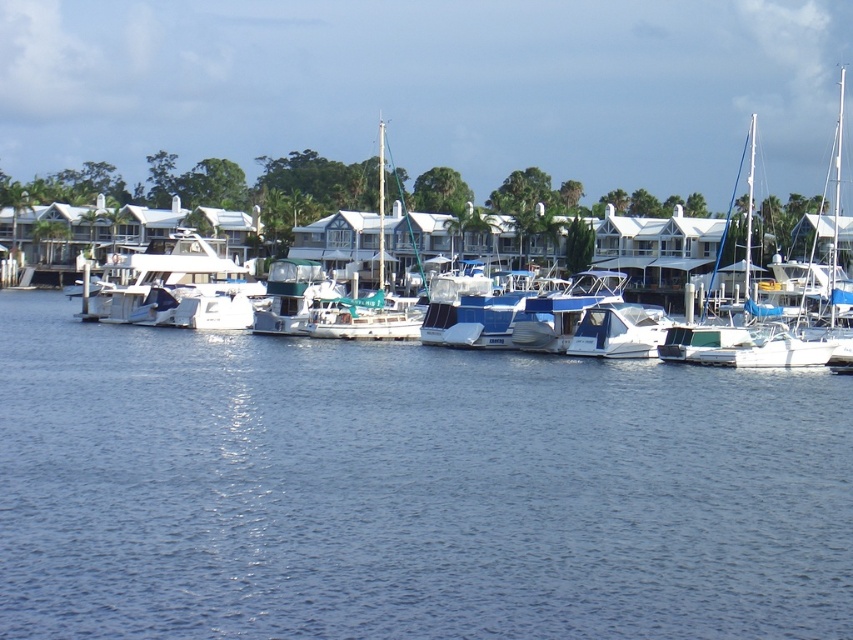
Question: Where is blue water at center located in relation to white matte boat at center in the image?

Choices:
 (A) left
 (B) right

Answer: (A)

Question: Is blue water at center smaller than white matte boat at center?

Choices:
 (A) no
 (B) yes

Answer: (B)

Question: Is blue water at center positioned at the back of white matte boat at center?

Choices:
 (A) yes
 (B) no

Answer: (B)

Question: Which point is closer to the camera?

Choices:
 (A) white matte boat at center
 (B) blue water at center

Answer: (B)

Question: Which point is farther to the camera?

Choices:
 (A) blue water at center
 (B) white matte boat at center

Answer: (B)

Question: Among these objects, which one is farthest from the camera?

Choices:
 (A) white matte boat at center
 (B) blue water at center

Answer: (A)